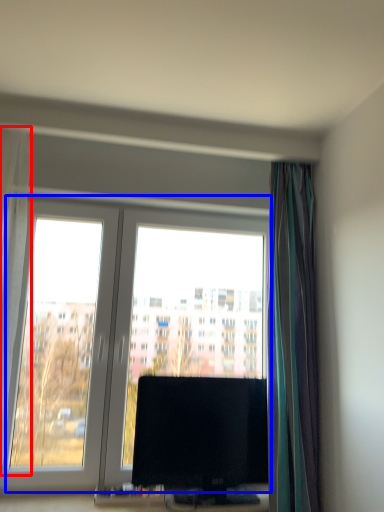
Question: Which object appears farthest to the camera in this image, curtain (highlighted by a red box) or window (highlighted by a blue box)?

Choices:
 (A) curtain
 (B) window

Answer: (B)